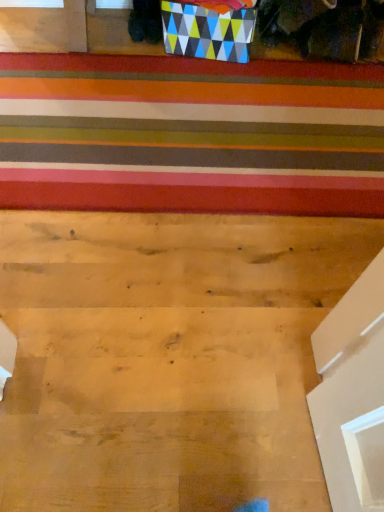
Measure the distance between geometric-patterned cardboard box at upper center and camera.

geometric-patterned cardboard box at upper center and camera are 1.62 meters apart from each other.

The width and height of the screenshot is (384, 512). Describe the element at coordinates (207, 32) in the screenshot. I see `geometric-patterned cardboard box at upper center` at that location.

Locate an element on the screen. geometric-patterned cardboard box at upper center is located at coordinates (207, 32).

In order to click on geometric-patterned cardboard box at upper center in this screenshot , I will do `click(207, 32)`.